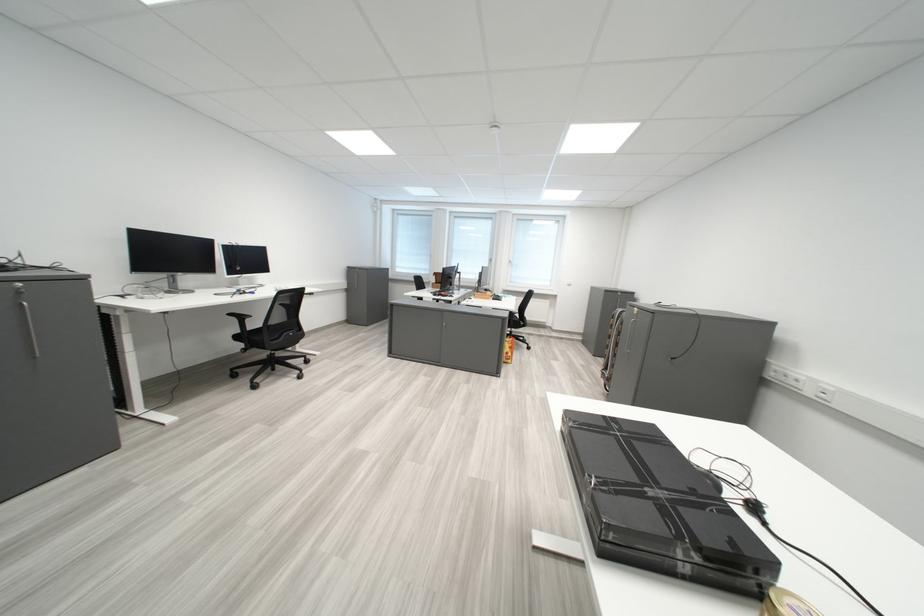
Where would you resting arm the black chair armrest? Please return your answer as a coordinate pair (x, y).

(237, 315)